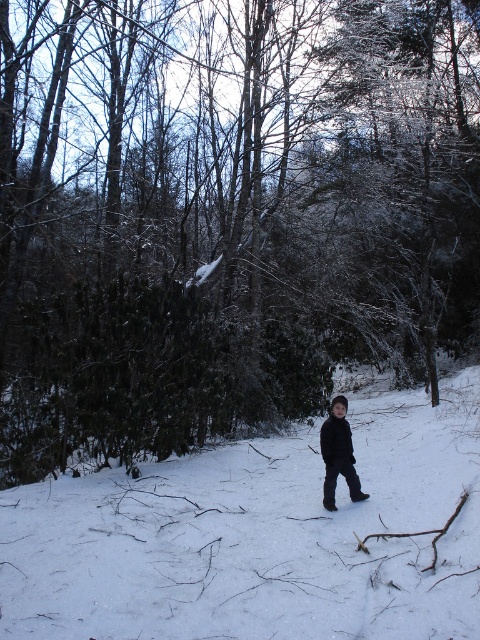
You are a photographer trying to capture the child in the winter scene. The camera is set up at ground level. Which object, the white fluffy snow at center or the black matte jacket at center, will appear closer to the camera in the photo?

The black matte jacket at center will appear closer to the camera because it has a greater height than the white fluffy snow at center, making it more prominent in the foreground.

You are a photographer trying to capture the child in the winter scene. Since the white fluffy snow at center and the black matte jacket at center are both at the center, which object should you focus on to ensure the child is clearly visible in your photo?

The white fluffy snow at center is in front of the black matte jacket at center, so focusing on the black matte jacket at center will ensure the child is clearly visible as it is behind the snow.